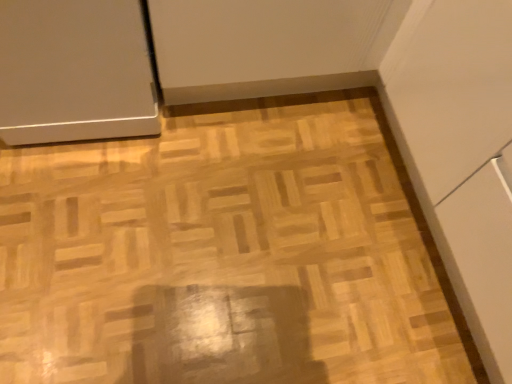
Question: Is satin white door at upper left far from natural wood parquet floor at center?

Choices:
 (A) yes
 (B) no

Answer: (B)

Question: Considering the relative sizes of satin white door at upper left and natural wood parquet floor at center in the image provided, is satin white door at upper left bigger than natural wood parquet floor at center?

Choices:
 (A) no
 (B) yes

Answer: (B)

Question: Is satin white door at upper left shorter than natural wood parquet floor at center?

Choices:
 (A) no
 (B) yes

Answer: (A)

Question: From the image's perspective, is satin white door at upper left under natural wood parquet floor at center?

Choices:
 (A) no
 (B) yes

Answer: (A)

Question: Can you confirm if satin white door at upper left is wider than natural wood parquet floor at center?

Choices:
 (A) yes
 (B) no

Answer: (B)

Question: From a real-world perspective, is satin white door at upper left positioned over natural wood parquet floor at center based on gravity?

Choices:
 (A) no
 (B) yes

Answer: (B)

Question: Is natural wood parquet floor at center thinner than satin white door at upper left?

Choices:
 (A) yes
 (B) no

Answer: (B)

Question: Can you confirm if natural wood parquet floor at center is shorter than satin white door at upper left?

Choices:
 (A) yes
 (B) no

Answer: (A)

Question: Does natural wood parquet floor at center have a greater height compared to satin white door at upper left?

Choices:
 (A) no
 (B) yes

Answer: (A)

Question: Are natural wood parquet floor at center and satin white door at upper left far apart?

Choices:
 (A) yes
 (B) no

Answer: (B)

Question: From the image's perspective, is natural wood parquet floor at center beneath satin white door at upper left?

Choices:
 (A) no
 (B) yes

Answer: (B)

Question: Considering the relative sizes of natural wood parquet floor at center and satin white door at upper left in the image provided, is natural wood parquet floor at center bigger than satin white door at upper left?

Choices:
 (A) yes
 (B) no

Answer: (B)

Question: In terms of width, does natural wood parquet floor at center look wider or thinner when compared to satin white door at upper left?

Choices:
 (A) thin
 (B) wide

Answer: (B)